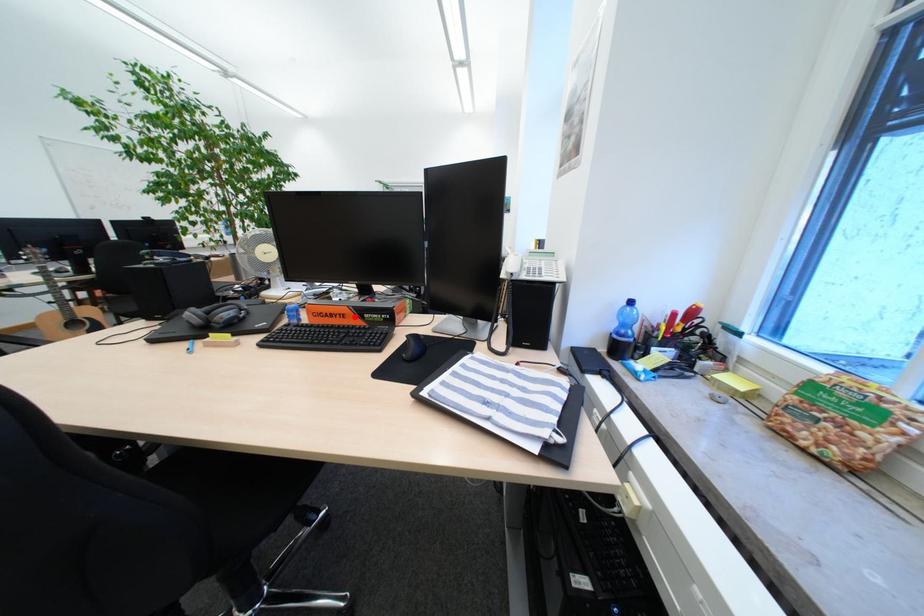
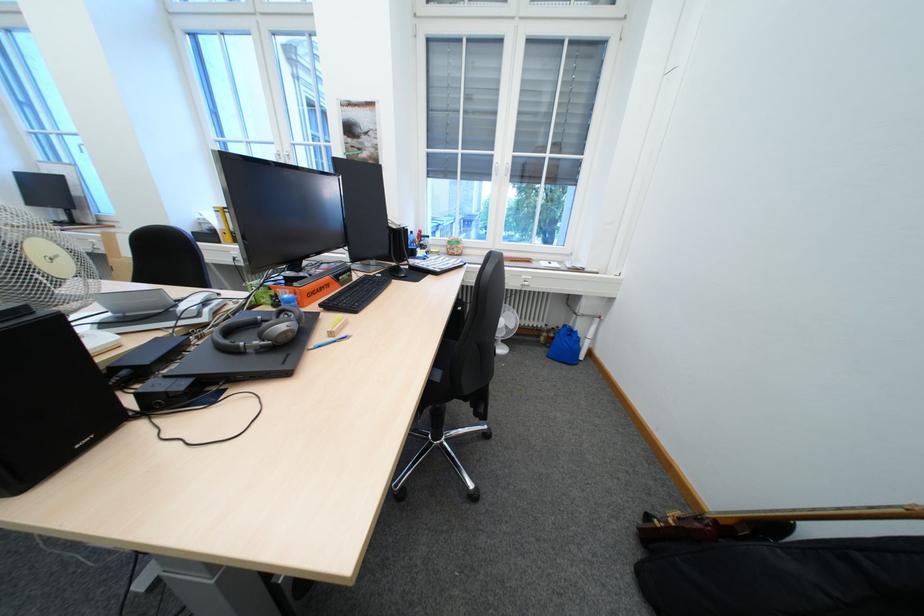
The point at the highlighted location is marked in the first image. Where is the corresponding point in the second image?

(339, 286)